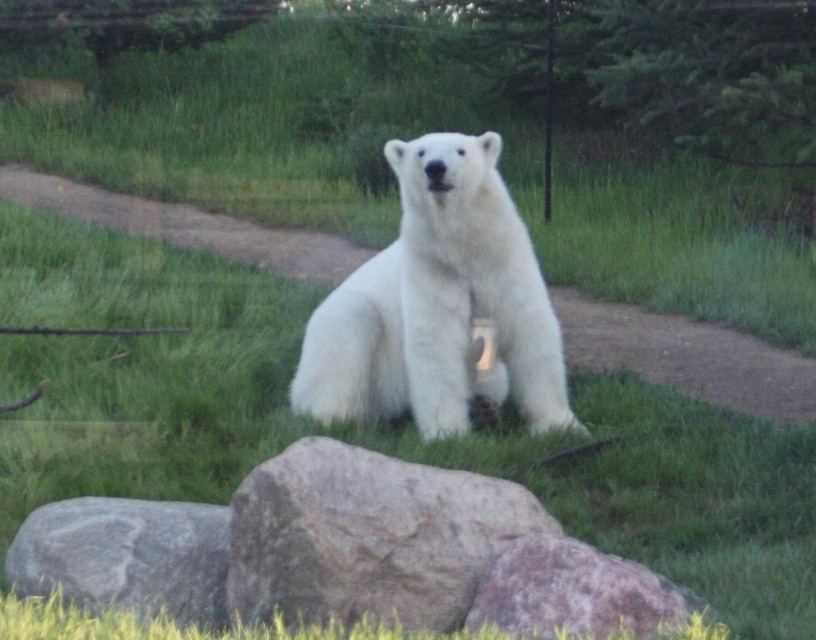
Question: Does white fluffy bear at center appear on the right side of gray rock at lower left?

Choices:
 (A) yes
 (B) no

Answer: (A)

Question: Which object is closer to the camera taking this photo?

Choices:
 (A) gray rough rock at center
 (B) gray rough rock at lower center

Answer: (B)

Question: Can you confirm if gray rough rock at center is positioned above gray rock at lower left?

Choices:
 (A) no
 (B) yes

Answer: (B)

Question: Which object appears farthest from the camera in this image?

Choices:
 (A) gray rough rock at center
 (B) gray rough rock at lower center

Answer: (A)

Question: Does gray rock at lower left have a smaller size compared to gray rough rock at lower center?

Choices:
 (A) no
 (B) yes

Answer: (A)

Question: Among these points, which one is nearest to the camera?

Choices:
 (A) (557, 356)
 (B) (315, 550)
 (C) (111, 515)
 (D) (586, 547)

Answer: (B)